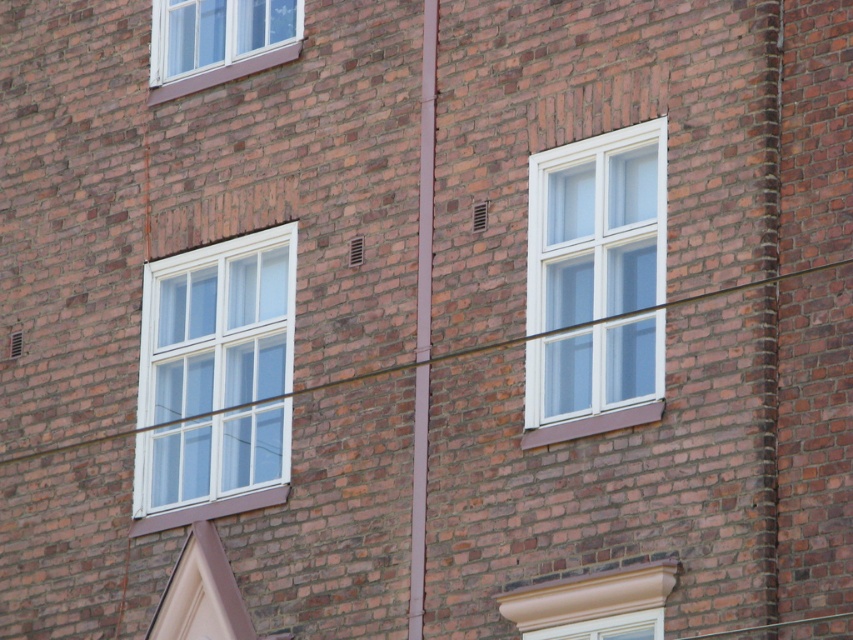
Question: Does white plastic window at center appear under white plastic window at upper left?

Choices:
 (A) yes
 (B) no

Answer: (A)

Question: Among these objects, which one is farthest from the camera?

Choices:
 (A) white plastic window at upper left
 (B) white plastic window at center-left
 (C) white plastic window at center

Answer: (A)

Question: Is white plastic window at center-left bigger than white plastic window at upper left?

Choices:
 (A) no
 (B) yes

Answer: (A)

Question: Which of the following is the closest to the observer?

Choices:
 (A) (564, 387)
 (B) (265, 497)

Answer: (A)

Question: Which of the following is the closest to the observer?

Choices:
 (A) (215, 403)
 (B) (165, 12)
 (C) (627, 209)

Answer: (C)

Question: Can you confirm if white plastic window at center-left is positioned to the left of white plastic window at center?

Choices:
 (A) yes
 (B) no

Answer: (A)